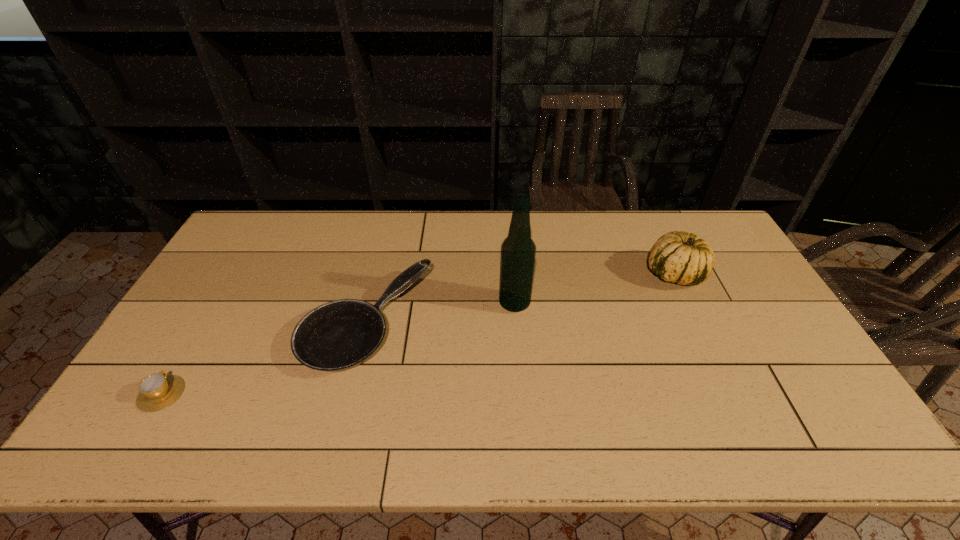
Locate an element on the screen. the second object from right to left is located at coordinates (518, 251).

The image size is (960, 540). In order to click on the tallest object in this screenshot , I will do `click(518, 251)`.

At what (x,y) coordinates should I click in order to perform the action: click on gourd. Please return your answer as a coordinate pair (x, y). Looking at the image, I should click on (678, 257).

Where is `the rightmost object`? This screenshot has height=540, width=960. the rightmost object is located at coordinates (678, 257).

The width and height of the screenshot is (960, 540). What are the coordinates of `the third tallest object` in the screenshot? It's located at (339, 335).

This screenshot has height=540, width=960. In order to click on frying pan in this screenshot , I will do `click(339, 335)`.

The height and width of the screenshot is (540, 960). What are the coordinates of `the shortest object` in the screenshot? It's located at (157, 391).

Image resolution: width=960 pixels, height=540 pixels. Identify the location of the leftmost object. (157, 391).

Find the location of a particular element. vacant point located 0.290m on the back of the alcohol is located at coordinates (509, 235).

What are the coordinates of `vacant space located 0.150m on the left of the gourd` in the screenshot? It's located at (598, 274).